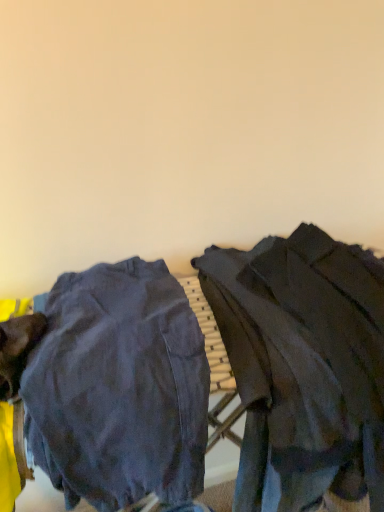
The width and height of the screenshot is (384, 512). What do you see at coordinates (303, 366) in the screenshot? I see `dark gray fabric jacket at right` at bounding box center [303, 366].

At what (x,y) coordinates should I click in order to perform the action: click on dark gray fabric jacket at right. Please return your answer as a coordinate pair (x, y). Looking at the image, I should click on (303, 366).

Where is `dark denim pants at center`? The height and width of the screenshot is (512, 384). dark denim pants at center is located at coordinates (119, 388).

What is the approximate width of dark denim pants at center?

It is 22.11 inches.

This screenshot has height=512, width=384. Describe the element at coordinates (119, 388) in the screenshot. I see `dark denim pants at center` at that location.

You are a GUI agent. You are given a task and a screenshot of the screen. Output one action in this format:
    pyautogui.click(x=<x>, y=<y>)
    Task: Click on the dark gray fabric jacket at right
    
    Given the screenshot: What is the action you would take?
    pyautogui.click(x=303, y=366)

Would you say dark denim pants at center is to the left or to the right of dark gray fabric jacket at right in the picture?

In the image, dark denim pants at center appears on the left side of dark gray fabric jacket at right.

Relative to dark gray fabric jacket at right, is dark denim pants at center in front or behind?

Visually, dark denim pants at center is located in front of dark gray fabric jacket at right.

Does point (61, 276) lie in front of point (319, 440)?

No, it is behind (319, 440).

From the image's perspective, is dark denim pants at center located above dark gray fabric jacket at right?

Actually, dark denim pants at center appears below dark gray fabric jacket at right in the image.

From a real-world perspective, is dark denim pants at center above or below dark gray fabric jacket at right?

dark denim pants at center is below dark gray fabric jacket at right.

Looking at this image, considering the sizes of objects dark denim pants at center and dark gray fabric jacket at right in the image provided, who is wider, dark denim pants at center or dark gray fabric jacket at right?

dark gray fabric jacket at right.

Between dark denim pants at center and dark gray fabric jacket at right, which one has more height?

With more height is dark gray fabric jacket at right.

Is dark denim pants at center bigger than dark gray fabric jacket at right?

No.

Would you say dark denim pants at center is inside or outside dark gray fabric jacket at right?

dark denim pants at center is outside dark gray fabric jacket at right.

Does dark denim pants at center touch dark gray fabric jacket at right?

No, dark denim pants at center is not with dark gray fabric jacket at right.

Is dark denim pants at center looking in the opposite direction of dark gray fabric jacket at right?

No.

How many degrees apart are the facing directions of dark denim pants at center and dark gray fabric jacket at right?

The angle between the facing direction of dark denim pants at center and the facing direction of dark gray fabric jacket at right is 0.513 degrees.

Image resolution: width=384 pixels, height=512 pixels. What are the coordinates of `jacket lying on the right of dark denim pants at center` in the screenshot? It's located at (x=303, y=366).

Visually, is dark gray fabric jacket at right positioned to the left or to the right of dark denim pants at center?

In the image, dark gray fabric jacket at right appears on the right side of dark denim pants at center.

Which object is further away from the camera, dark gray fabric jacket at right or dark denim pants at center?

dark gray fabric jacket at right is further from the camera.

Is point (379, 367) more distant than point (154, 489)?

Yes, point (379, 367) is behind point (154, 489).

From the image's perspective, relative to dark denim pants at center, is dark gray fabric jacket at right above or below?

dark gray fabric jacket at right is situated higher than dark denim pants at center in the image.

Consider the image. From a real-world perspective, who is located lower, dark gray fabric jacket at right or dark denim pants at center?

From a 3D spatial view, dark denim pants at center is below.

Does dark gray fabric jacket at right have a greater width compared to dark denim pants at center?

Indeed, dark gray fabric jacket at right has a greater width compared to dark denim pants at center.

Can you confirm if dark gray fabric jacket at right is shorter than dark denim pants at center?

Incorrect, the height of dark gray fabric jacket at right does not fall short of that of dark denim pants at center.

Considering the sizes of dark gray fabric jacket at right and dark denim pants at center in the image, is dark gray fabric jacket at right bigger or smaller than dark denim pants at center?

dark gray fabric jacket at right is bigger than dark denim pants at center.

Would you say dark gray fabric jacket at right is inside or outside dark denim pants at center?

The correct answer is: outside.

Is dark gray fabric jacket at right next to dark denim pants at center and touching it?

dark gray fabric jacket at right and dark denim pants at center are clearly separated.

Is dark denim pants at center at the back of dark gray fabric jacket at right?

No.

There is a dark denim pants at center. Where is `jacket above it (from a real-world perspective)`? Image resolution: width=384 pixels, height=512 pixels. jacket above it (from a real-world perspective) is located at coordinates pos(303,366).

Locate an element on the screen. The image size is (384, 512). tight below the dark gray fabric jacket at right (from the image's perspective) is located at coordinates (119, 388).

Identify the location of jacket on the right of dark denim pants at center. The height and width of the screenshot is (512, 384). [x=303, y=366].